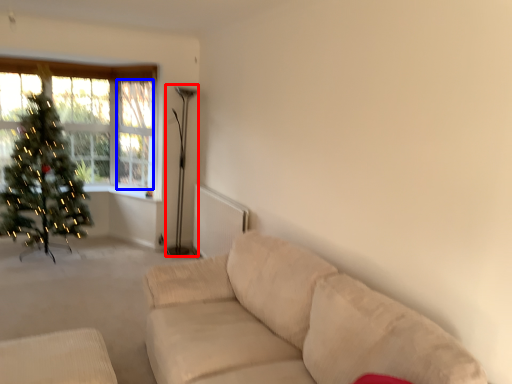
Question: Which point is further to the camera, lamp (highlighted by a red box) or window screen (highlighted by a blue box)?

Choices:
 (A) lamp
 (B) window screen

Answer: (B)